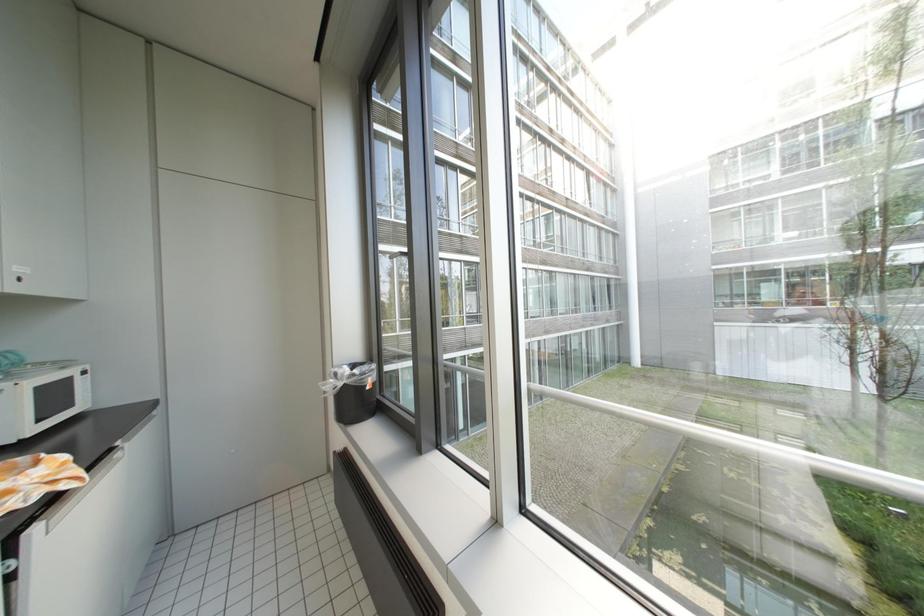
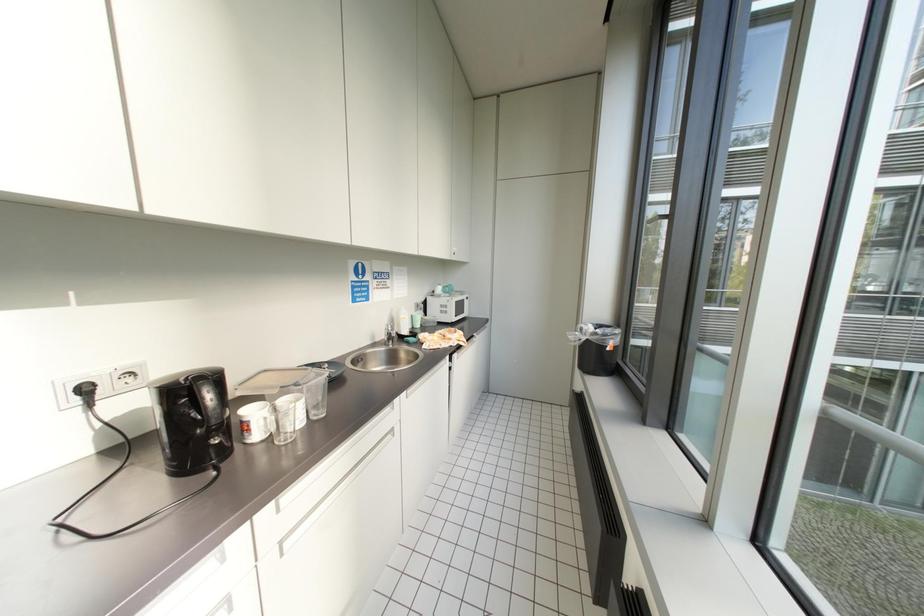
Question: The camera is either moving clockwise (left) or counter-clockwise (right) around the object. The first image is from the beginning of the video and the second image is from the end. Is the camera moving left or right when shooting the video?

Choices:
 (A) Left
 (B) Right

Answer: (B)